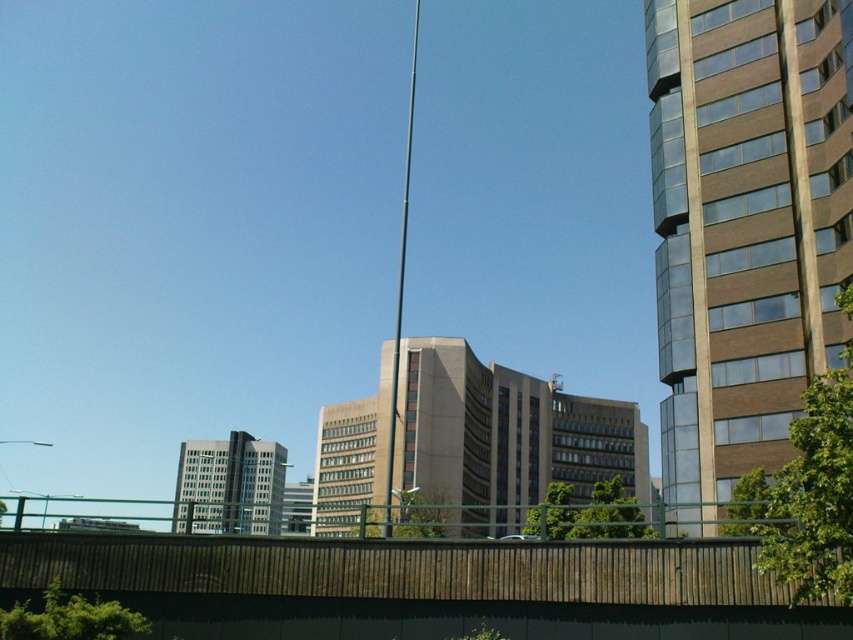
Question: Which is nearer to the brown wooden fence at lower center?

Choices:
 (A) gray concrete building at lower left
 (B) beige concrete building at center
 (C) brown concrete building at right

Answer: (C)

Question: Is brown wooden fence at lower center further to camera compared to gray concrete building at lower left?

Choices:
 (A) no
 (B) yes

Answer: (A)

Question: Which point appears closest to the camera in this image?

Choices:
 (A) (486, 529)
 (B) (393, 355)
 (C) (218, 451)
 (D) (828, 284)

Answer: (D)

Question: Is brown wooden fence at lower center below metallic flag pole at center?

Choices:
 (A) no
 (B) yes

Answer: (B)

Question: From the image, what is the correct spatial relationship of brown wooden fence at lower center in relation to gray concrete building at lower left?

Choices:
 (A) above
 (B) below

Answer: (A)

Question: Which point is farther from the camera taking this photo?

Choices:
 (A) (405, 134)
 (B) (669, 268)
 (C) (219, 496)
 (D) (392, 465)

Answer: (A)